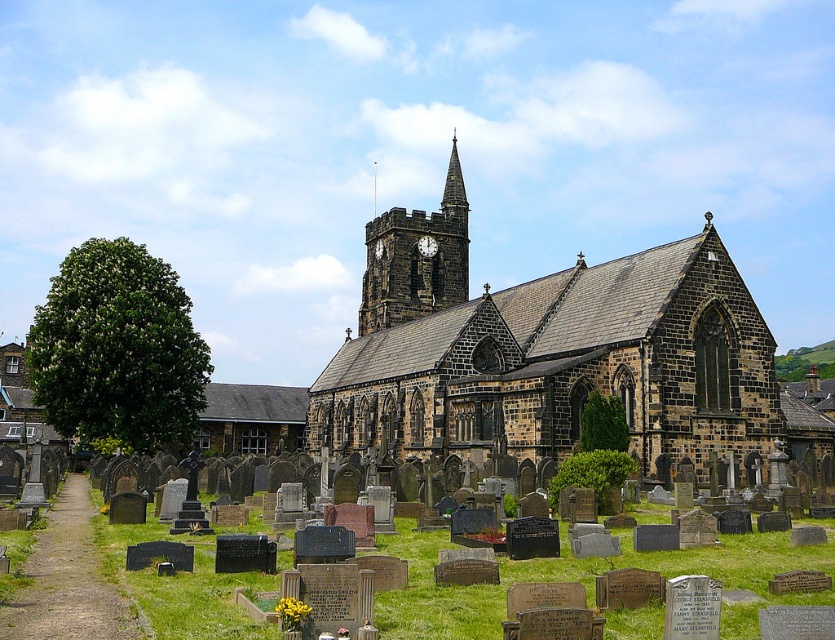
Based on the photo, is brown stone church at center positioned in front of smooth stone spire at upper center?

Yes, it is.

Between point (669, 387) and point (451, 205), which one is positioned behind?

The point (451, 205) is more distant.

Image resolution: width=835 pixels, height=640 pixels. I want to click on brown stone church at center, so click(545, 353).

Does smooth stone spire at upper center come in front of white wooden clock at center?

No, smooth stone spire at upper center is behind white wooden clock at center.

Is smooth stone spire at upper center smaller than white wooden clock at center?

No.

Is point (456, 168) farther from viewer compared to point (423, 252)?

Yes, point (456, 168) is farther from viewer.

This screenshot has width=835, height=640. Find the location of `smooth stone spire at upper center`. smooth stone spire at upper center is located at coordinates (453, 184).

How distant is brown stone church at center from white wooden clock at center?

brown stone church at center and white wooden clock at center are 27.80 meters apart from each other.

Which is below, brown stone church at center or white wooden clock at center?

brown stone church at center

Is point (449, 365) positioned behind point (424, 240)?

No, it is in front of (424, 240).

Where is `brown stone church at center`? brown stone church at center is located at coordinates (545, 353).